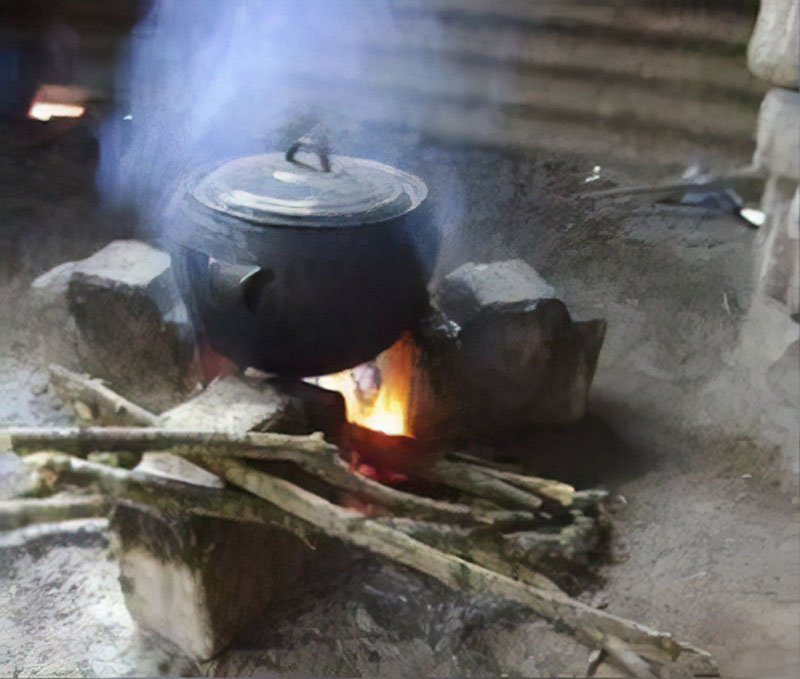
If there are any where pot lid would be picked up present in the image, indicate their positions. Your answer should be formatted as a list of tuples, i.e. [(x1, y1), (x2, y2), ...], where each tuple contains the x and y coordinates of a point satisfying the conditions above.

[(316, 140)]